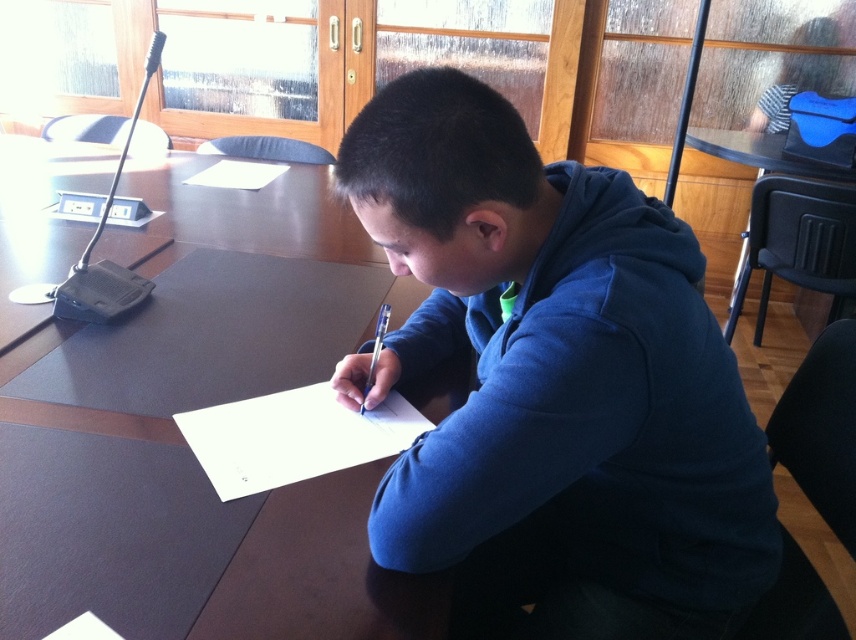
You are organizing a small event and need to place a 6 feet long banner between the dark brown wood table at center and the transparent glass table at center. Is there enough space to place it without bending the banner?

The dark brown wood table at center is 6.12 feet from transparent glass table at center, so yes, there is enough space to place a 6 feet long banner between them without bending it.

Please describe the position of the blue fleece jacket at center in terms of its coordinates within the image frame. The image frame has a coordinate system where the origin is at the bottom left corner, with the x and y axes increasing to the right and upwards respectively. The coordinates are normalized between 0 and 1. You must use the exact object label from the provided list in your answer.

The blue fleece jacket at center is located at coordinates x 0.600 and y 0.651 within the image frame.

From the picture: You are a guest speaker at a conference and need to place your notes on the table. However, you notice both the blue fleece jacket at center and the dark brown wood table at center are in your line of sight. Which object should you interact with to place your notes?

The dark brown wood table at center is behind the blue fleece jacket at center, so you should move the blue fleece jacket at center to access the table or place the notes on the table behind it.